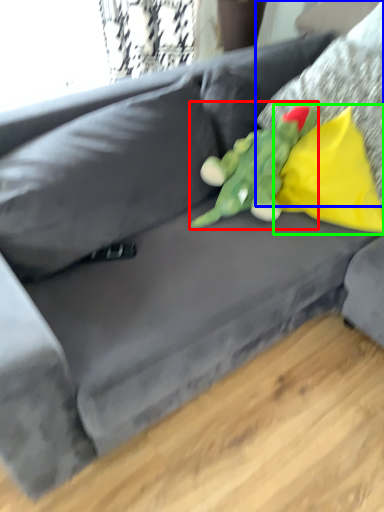
Question: Considering the real-world distances, which object is closest to toy (highlighted by a red box)? pillow (highlighted by a blue box) or pillow (highlighted by a green box).

Choices:
 (A) pillow
 (B) pillow

Answer: (B)